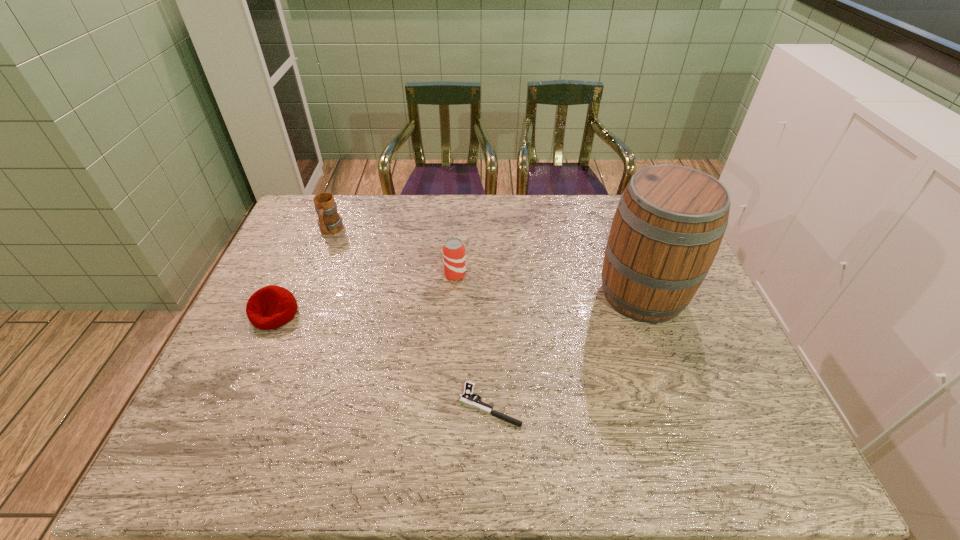
Locate an element on the screen. This screenshot has height=540, width=960. the rightmost object is located at coordinates (670, 221).

Find the location of `the tallest object`. the tallest object is located at coordinates (670, 221).

The width and height of the screenshot is (960, 540). Identify the location of beer can. (453, 249).

The width and height of the screenshot is (960, 540). I want to click on mug, so click(x=329, y=221).

I want to click on the second shortest object, so click(x=271, y=307).

Locate an element on the screen. Image resolution: width=960 pixels, height=540 pixels. the nearest object is located at coordinates pyautogui.click(x=466, y=398).

Locate an element on the screen. The height and width of the screenshot is (540, 960). pistol is located at coordinates (466, 398).

At what (x,y) coordinates should I click in order to perform the action: click on blank space located 0.160m on the front of the rightmost object. Please return your answer as a coordinate pair (x, y). Looking at the image, I should click on (674, 381).

Find the location of `vacant space located on the left of the beer can`. vacant space located on the left of the beer can is located at coordinates (342, 274).

The height and width of the screenshot is (540, 960). I want to click on vacant space located on the side of the farthest object with the handle, so click(306, 294).